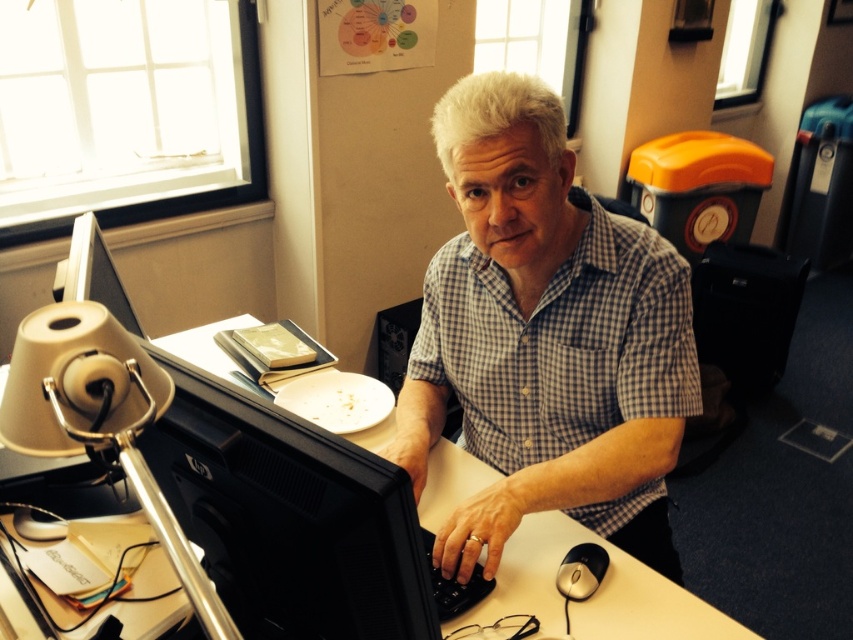
What object is located at the coordinates point (595, 593)?

The point (595, 593) indicates the matte black monitor at center.

What object is located at the coordinates point (289, 516) in the scene?

The point (289, 516) marks the location of the black plastic monitor at center.

You are a delivery person who needs to place a 27 inch box on the desk between the black glossy monitor at left and the black plastic keyboard at center. Is there enough space between them?

The distance between the black glossy monitor at left and the black plastic keyboard at center is 26.94 inches, so there isn not enough space to place a 27 inch box between them.